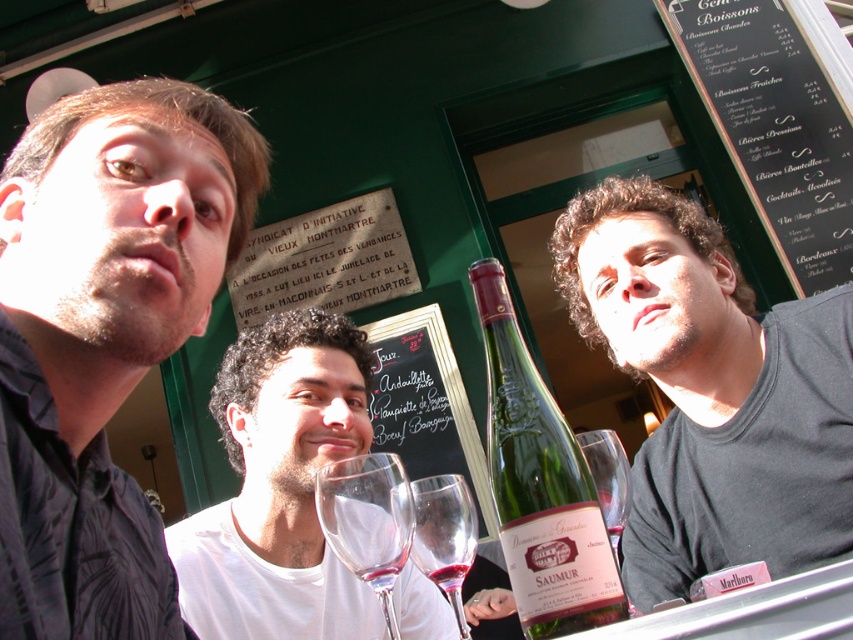
You are a waiter at a French restaurant and need to place a new wine bottle on the table. The table has limited space. The existing green glass bottle at center is represented by point (540, 484). Where should you place the new bottle to ensure it doesn not collide with the existing one?

Place the new bottle away from the point (540, 484) to avoid collision with the existing green glass bottle at center.

You are standing at the point labeled point (62, 172) and want to walk to the point labeled point (553, 454). Which direction should you move first?

You should move forward because point (62, 172) is behind point (553, 454), so moving forward from point (62, 172) will lead you toward point (553, 454).